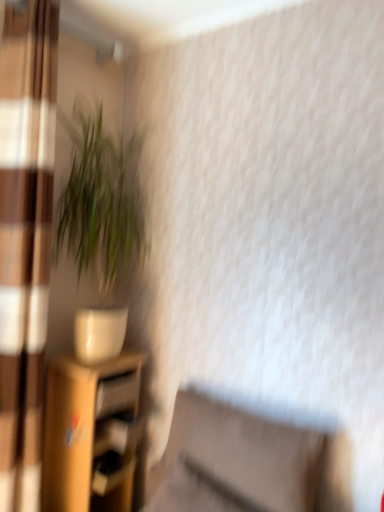
Find the location of a particular element. The width and height of the screenshot is (384, 512). wooden shelf at lower left is located at coordinates (91, 434).

The image size is (384, 512). Describe the element at coordinates (117, 394) in the screenshot. I see `wooden drawer at lower left` at that location.

The height and width of the screenshot is (512, 384). I want to click on wooden shelf at lower left, so click(x=91, y=434).

Which of these two, matte brown curtain at left or matte brown swivel chair at lower center, stands shorter?

Standing shorter between the two is matte brown swivel chair at lower center.

Is matte brown curtain at left closer to camera compared to matte brown swivel chair at lower center?

No, it is not.

From the picture: Is matte brown curtain at left to the left or to the right of matte brown swivel chair at lower center in the image?

matte brown curtain at left is to the left of matte brown swivel chair at lower center.

Is point (48, 225) more distant than point (345, 483)?

That is True.

Relative to wooden shelf at lower left, is wooden drawer at lower left in front or behind?

wooden drawer at lower left is positioned farther from the viewer than wooden shelf at lower left.

Is wooden drawer at lower left bigger than wooden shelf at lower left?

No, wooden drawer at lower left is not bigger than wooden shelf at lower left.

Which is in front, point (98, 402) or point (66, 432)?

The point (98, 402) is closer.

The height and width of the screenshot is (512, 384). Find the location of `drawer that is behind the wooden shelf at lower left`. drawer that is behind the wooden shelf at lower left is located at coordinates (117, 394).

How different are the orientations of wooden shelf at lower left and matte brown swivel chair at lower center in degrees?

The angular difference between wooden shelf at lower left and matte brown swivel chair at lower center is 91.9 degrees.

Does wooden shelf at lower left have a smaller size compared to matte brown swivel chair at lower center?

No, wooden shelf at lower left is not smaller than matte brown swivel chair at lower center.

Can you confirm if wooden shelf at lower left is taller than matte brown swivel chair at lower center?

Correct, wooden shelf at lower left is much taller as matte brown swivel chair at lower center.

From the picture: Between wooden shelf at lower left and matte brown swivel chair at lower center, which one has larger width?

Wider between the two is wooden shelf at lower left.

Does green leafy plant at left have a larger size compared to wooden shelf at lower left?

Incorrect, green leafy plant at left is not larger than wooden shelf at lower left.

Is green leafy plant at left to the right of wooden shelf at lower left from the viewer's perspective?

Indeed, green leafy plant at left is positioned on the right side of wooden shelf at lower left.

How many degrees apart are the facing directions of green leafy plant at left and wooden shelf at lower left?

green leafy plant at left and wooden shelf at lower left are facing 1.98 degrees away from each other.

Which object is further away from the camera, green leafy plant at left or wooden shelf at lower left?

wooden shelf at lower left is more distant.

Considering the relative sizes of matte brown swivel chair at lower center and matte brown curtain at left in the image provided, is matte brown swivel chair at lower center shorter than matte brown curtain at left?

Correct, matte brown swivel chair at lower center is not as tall as matte brown curtain at left.

Is matte brown curtain at left surrounded by matte brown swivel chair at lower center?

No, matte brown curtain at left is not surrounded by matte brown swivel chair at lower center.

How different are the orientations of matte brown swivel chair at lower center and matte brown curtain at left in degrees?

91.8 degrees.

From a real-world perspective, is matte brown swivel chair at lower center positioned over matte brown curtain at left based on gravity?

No, from a real-world perspective, matte brown swivel chair at lower center is not on top of matte brown curtain at left.

Is wooden drawer at lower left surrounded by green leafy plant at left?

No, wooden drawer at lower left is not inside green leafy plant at left.

Is wooden drawer at lower left at the back of green leafy plant at left?

No, green leafy plant at left is not facing away from wooden drawer at lower left.

Considering the relative positions of green leafy plant at left and wooden drawer at lower left in the image provided, is green leafy plant at left in front of wooden drawer at lower left?

That is True.

Considering the sizes of green leafy plant at left and wooden drawer at lower left in the image, is green leafy plant at left bigger or smaller than wooden drawer at lower left?

Clearly, green leafy plant at left is larger in size than wooden drawer at lower left.

Between wooden shelf at lower left and wooden drawer at lower left, which one is positioned behind?

wooden drawer at lower left is further from the camera.

From the picture: Is wooden shelf at lower left inside or outside of wooden drawer at lower left?

wooden shelf at lower left is not inside wooden drawer at lower left, it's outside.

Who is bigger, wooden shelf at lower left or wooden drawer at lower left?

With larger size is wooden shelf at lower left.

Does point (46, 465) come farther from viewer compared to point (98, 410)?

Yes.

Locate an element on the screen. Image resolution: width=384 pixels, height=512 pixels. curtain behind the matte brown swivel chair at lower center is located at coordinates 25,240.

Identify the location of drawer positioned vertically above the wooden shelf at lower left (from a real-world perspective). This screenshot has height=512, width=384. (117, 394).

When comparing their distances from wooden drawer at lower left, does wooden shelf at lower left or matte brown swivel chair at lower center seem further?

matte brown swivel chair at lower center.

In the scene shown: Considering their positions, is wooden shelf at lower left positioned closer to wooden drawer at lower left than green leafy plant at left?

wooden shelf at lower left lies closer to wooden drawer at lower left than the other object.

Which object lies further to the anchor point wooden drawer at lower left, matte brown curtain at left or green leafy plant at left?

green leafy plant at left.

Considering their positions, is matte brown curtain at left positioned closer to green leafy plant at left than matte brown swivel chair at lower center?

Based on the image, matte brown curtain at left appears to be nearer to green leafy plant at left.

In the scene shown: From the image, which object appears to be farther from matte brown swivel chair at lower center, wooden shelf at lower left or green leafy plant at left?

green leafy plant at left.

Based on their spatial positions, is wooden shelf at lower left or matte brown curtain at left closer to green leafy plant at left?

Among the two, matte brown curtain at left is located nearer to green leafy plant at left.

Looking at this image, based on their spatial positions, is matte brown curtain at left or wooden shelf at lower left closer to matte brown swivel chair at lower center?

wooden shelf at lower left.

Which object lies nearer to the anchor point matte brown swivel chair at lower center, wooden drawer at lower left or green leafy plant at left?

Among the two, wooden drawer at lower left is located nearer to matte brown swivel chair at lower center.

The height and width of the screenshot is (512, 384). I want to click on drawer between green leafy plant at left and matte brown swivel chair at lower center in the vertical direction, so click(x=117, y=394).

This screenshot has width=384, height=512. I want to click on swivel chair between matte brown curtain at left and wooden shelf at lower left in the vertical direction, so click(248, 462).

Identify the location of curtain between green leafy plant at left and wooden drawer at lower left in the up-down direction. (25, 240).

Find the location of a particular element. The image size is (384, 512). drawer between green leafy plant at left and wooden shelf at lower left in the vertical direction is located at coordinates (117, 394).